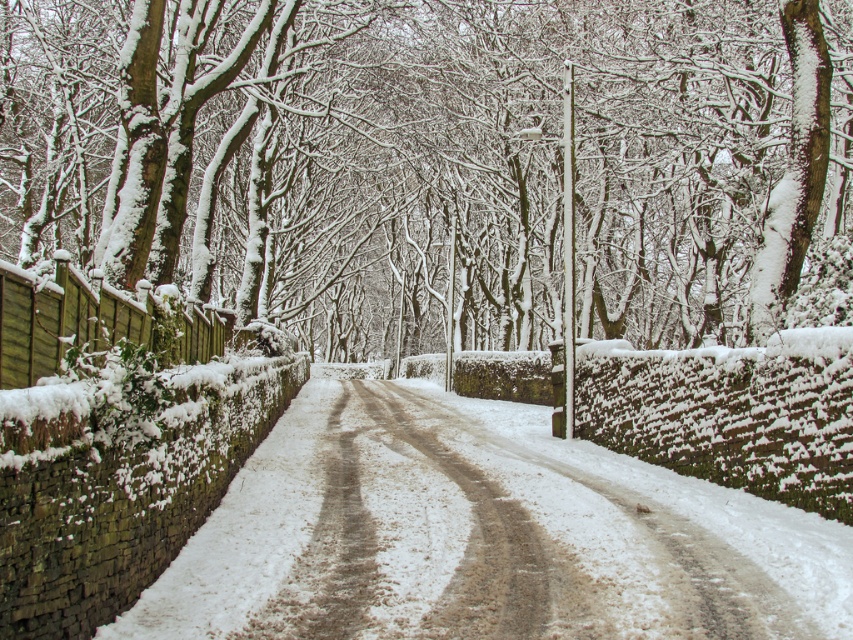
You are standing at the starting point of the road and want to reach the end of the road. Which point, point [595,24] or point [669,541], is closer to your current position?

Point [669,541] is closer to your current position because it is in front of point [595,24].